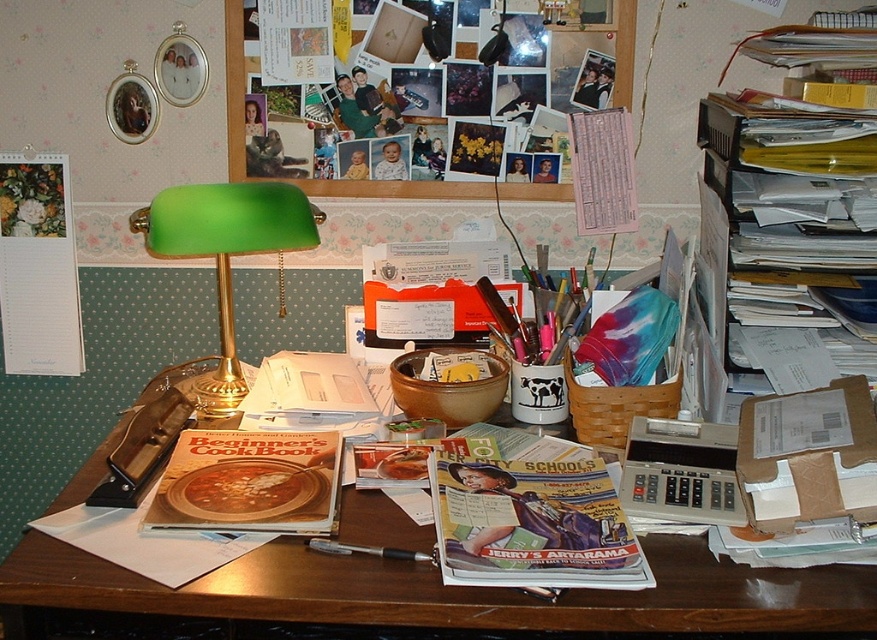
Question: Which of these objects is positioned farthest from the metallic pen at center?

Choices:
 (A) matte paper cookbook at center
 (B) wooden cutting board at center
 (C) matte paper magazine at center

Answer: (B)

Question: Among these points, which one is nearest to the camera?

Choices:
 (A) (189, 406)
 (B) (802, 602)
 (C) (296, 472)
 (D) (244, 196)

Answer: (B)

Question: Does matte paper magazine at center have a larger size compared to wooden cutting board at center?

Choices:
 (A) yes
 (B) no

Answer: (A)

Question: Is matte paper cookbook at center to the right of wooden cutting board at center from the viewer's perspective?

Choices:
 (A) yes
 (B) no

Answer: (A)

Question: Is matte paper magazine at center to the left of matte paper cookbook at center from the viewer's perspective?

Choices:
 (A) yes
 (B) no

Answer: (B)

Question: Which object appears closest to the camera in this image?

Choices:
 (A) matte paper magazine at center
 (B) metallic pen at center

Answer: (A)